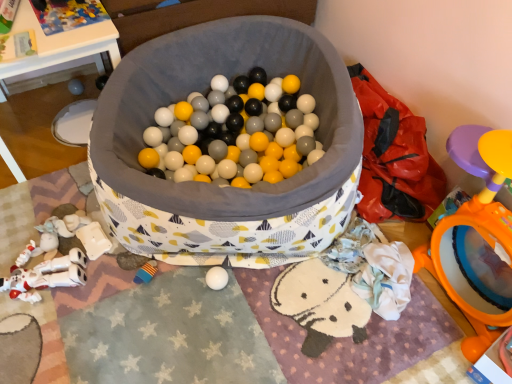
Measure the distance between point (x=472, y=227) and camera.

Point (x=472, y=227) and camera are 1.17 meters apart.

Find the location of `soft plush toy at lower left, positioned as the fourth toy in left-to-right order`. soft plush toy at lower left, positioned as the fourth toy in left-to-right order is located at coordinates (146, 272).

What do you see at coordinates (75, 87) in the screenshot? I see `matte gray ball at left, which is the fifth toy from right to left` at bounding box center [75, 87].

In order to face white plush toy at lower left, which is the 4th toy in top-to-bottom order, should I rotate leftwards or rightwards?

You should rotate left by 26.653 degrees.

This screenshot has width=512, height=384. Identify the location of fabric-lined ball pit at center. (205, 89).

Identify the location of orange plastic mirror at right, acting as the 3th toy starting from the top. The image size is (512, 384). (477, 239).

Can you confirm if white plush toy at lower left, arranged as the 2th toy when viewed from the front, is smaller than matte gray ball at left, the 1th toy from the back?

No, white plush toy at lower left, arranged as the 2th toy when viewed from the front, is not smaller than matte gray ball at left, the 1th toy from the back.

Considering the relative sizes of white plush toy at lower left, which is the 4th toy in top-to-bottom order, and matte gray ball at left, the 1th toy from the back, in the image provided, is white plush toy at lower left, which is the 4th toy in top-to-bottom order, wider than matte gray ball at left, the 1th toy from the back,?

Correct, the width of white plush toy at lower left, which is the 4th toy in top-to-bottom order, exceeds that of matte gray ball at left, the 1th toy from the back.

In terms of height, does white plush toy at lower left, the second toy positioned from the bottom, look taller or shorter compared to matte gray ball at left, the 1th toy from the back?

Clearly, white plush toy at lower left, the second toy positioned from the bottom, is taller compared to matte gray ball at left, the 1th toy from the back.

Locate an element on the screen. toy that is the 2nd object located above the white plush toy at lower left, the second toy positioned from the bottom (from the image's perspective) is located at coordinates (75, 87).

Does matte gray ball at left, which appears as the first toy when viewed from the left, come behind orange plastic mirror at right, arranged as the fifth toy when viewed from the back?

Yes, matte gray ball at left, which appears as the first toy when viewed from the left, is behind orange plastic mirror at right, arranged as the fifth toy when viewed from the back.

Which is further, (x=76, y=93) or (x=447, y=291)?

The point (x=76, y=93) is farther.

Are matte gray ball at left, arranged as the second toy when viewed from the top, and orange plastic mirror at right, arranged as the fifth toy when viewed from the back, located far from each other?

Yes.

From the image's perspective, does matte gray ball at left, the fourth toy positioned from the bottom, appear higher than orange plastic mirror at right, acting as the 3th toy starting from the top?

Yes, from the image's perspective, matte gray ball at left, the fourth toy positioned from the bottom, is above orange plastic mirror at right, acting as the 3th toy starting from the top.

Who is taller, fabric-lined ball pit at center or plastic colorful puzzle pieces at upper left, positioned as the third toy in right-to-left order?

Standing taller between the two is fabric-lined ball pit at center.

From a real-world perspective, is fabric-lined ball pit at center positioned above or below plastic colorful puzzle pieces at upper left, placed as the 3th toy when sorted from left to right?

Clearly, from a real-world perspective, fabric-lined ball pit at center is below plastic colorful puzzle pieces at upper left, placed as the 3th toy when sorted from left to right.

Is fabric-lined ball pit at center oriented away from plastic colorful puzzle pieces at upper left, marked as the fifth toy in a bottom-to-top arrangement?

No, fabric-lined ball pit at center is not facing away from plastic colorful puzzle pieces at upper left, marked as the fifth toy in a bottom-to-top arrangement.

From a real-world perspective, starting from the fabric-lined ball pit at center, which toy is the 2nd one vertically above it? Please provide its 2D coordinates.

[(67, 14)]

Is orange plastic mirror at right, arranged as the 3th toy when ordered from the bottom, in contact with soft plush toy at lower left, positioned as the 2th toy in right-to-left order?

orange plastic mirror at right, arranged as the 3th toy when ordered from the bottom, and soft plush toy at lower left, positioned as the 2th toy in right-to-left order, are not in contact.

From the image's perspective, is orange plastic mirror at right, acting as the first toy starting from the front, on soft plush toy at lower left, positioned as the 2th toy in right-to-left order?

Yes.

From a real-world perspective, who is located lower, orange plastic mirror at right, acting as the first toy starting from the front, or soft plush toy at lower left, positioned as the fourth toy in left-to-right order?

soft plush toy at lower left, positioned as the fourth toy in left-to-right order, is physically lower.

Considering the sizes of objects orange plastic mirror at right, which is counted as the fifth toy, starting from the left, and soft plush toy at lower left, the third toy in the front-to-back sequence, in the image provided, who is wider, orange plastic mirror at right, which is counted as the fifth toy, starting from the left, or soft plush toy at lower left, the third toy in the front-to-back sequence,?

orange plastic mirror at right, which is counted as the fifth toy, starting from the left.

Is white plush toy at lower left, the second toy positioned from the bottom, not within plastic colorful puzzle pieces at upper left, placed as the 3th toy when sorted from left to right?

Indeed, white plush toy at lower left, the second toy positioned from the bottom, is completely outside plastic colorful puzzle pieces at upper left, placed as the 3th toy when sorted from left to right.

Considering the positions of objects white plush toy at lower left, which ranks as the fourth toy in back-to-front order, and plastic colorful puzzle pieces at upper left, placed as the 3th toy when sorted from left to right, in the image provided, who is behind, white plush toy at lower left, which ranks as the fourth toy in back-to-front order, or plastic colorful puzzle pieces at upper left, placed as the 3th toy when sorted from left to right,?

plastic colorful puzzle pieces at upper left, placed as the 3th toy when sorted from left to right, is more distant.

Looking at this image, considering the relative positions of white plush toy at lower left, which is the 4th toy in top-to-bottom order, and plastic colorful puzzle pieces at upper left, which is counted as the fourth toy, starting from the front, in the image provided, is white plush toy at lower left, which is the 4th toy in top-to-bottom order, to the left of plastic colorful puzzle pieces at upper left, which is counted as the fourth toy, starting from the front, from the viewer's perspective?

Yes, white plush toy at lower left, which is the 4th toy in top-to-bottom order, is to the left of plastic colorful puzzle pieces at upper left, which is counted as the fourth toy, starting from the front.

Is white plush toy at lower left, arranged as the 2th toy when viewed from the front, directly adjacent to plastic colorful puzzle pieces at upper left, marked as the fifth toy in a bottom-to-top arrangement?

No, white plush toy at lower left, arranged as the 2th toy when viewed from the front, is not in contact with plastic colorful puzzle pieces at upper left, marked as the fifth toy in a bottom-to-top arrangement.

Is the surface of soft plush toy at lower left, positioned as the 5th toy in top-to-bottom order, in direct contact with white plush toy at lower left, arranged as the 2th toy when viewed from the front?

No.

Is white plush toy at lower left, which is counted as the 2th toy, starting from the left, at the back of soft plush toy at lower left, which appears as the first toy when ordered from the bottom?

No, soft plush toy at lower left, which appears as the first toy when ordered from the bottom,'s orientation is not away from white plush toy at lower left, which is counted as the 2th toy, starting from the left.

Image resolution: width=512 pixels, height=384 pixels. I want to click on laundry basket located above the white plush toy at lower left, the second toy positioned from the bottom (from the image's perspective), so click(205, 89).

Which of these two, white plush toy at lower left, arranged as the 2th toy when viewed from the front, or fabric-lined ball pit at center, is smaller?

white plush toy at lower left, arranged as the 2th toy when viewed from the front.

From the image's perspective, would you say white plush toy at lower left, the second toy positioned from the bottom, is positioned over fabric-lined ball pit at center?

Actually, white plush toy at lower left, the second toy positioned from the bottom, appears below fabric-lined ball pit at center in the image.

From the image's perspective, count 2nd toys upward from the white plush toy at lower left, which is counted as the 2th toy, starting from the left, and point to it. Please provide its 2D coordinates.

[(75, 87)]

Where is `toy that is the 2nd object directly below the orange plastic mirror at right, arranged as the fifth toy when viewed from the back (from a real-world perspective)`? toy that is the 2nd object directly below the orange plastic mirror at right, arranged as the fifth toy when viewed from the back (from a real-world perspective) is located at coordinates (75, 87).

From the picture: Looking at the image, which one is located closer to fabric-lined ball pit at center, soft plush toy at lower left, positioned as the fourth toy in left-to-right order, or plastic colorful puzzle pieces at upper left, placed as the 3th toy when sorted from left to right?

Among the two, plastic colorful puzzle pieces at upper left, placed as the 3th toy when sorted from left to right, is located nearer to fabric-lined ball pit at center.

When comparing their distances from soft plush toy at lower left, the third toy viewed from the back, does matte gray ball at left, the 1th toy from the back, or orange plastic mirror at right, arranged as the 3th toy when ordered from the bottom, seem closer?

Based on the image, orange plastic mirror at right, arranged as the 3th toy when ordered from the bottom, appears to be nearer to soft plush toy at lower left, the third toy viewed from the back.

Looking at the image, which one is located closer to matte gray ball at left, which appears as the first toy when viewed from the left, plastic colorful puzzle pieces at upper left, placed as the 3th toy when sorted from left to right, or fabric-lined ball pit at center?

plastic colorful puzzle pieces at upper left, placed as the 3th toy when sorted from left to right.

Consider the image. Which object lies nearer to the anchor point plastic colorful puzzle pieces at upper left, positioned as the third toy in right-to-left order, soft plush toy at lower left, which appears as the first toy when ordered from the bottom, or orange plastic mirror at right, the first toy from the right?

soft plush toy at lower left, which appears as the first toy when ordered from the bottom, lies closer to plastic colorful puzzle pieces at upper left, positioned as the third toy in right-to-left order, than the other object.

Based on their spatial positions, is fabric-lined ball pit at center or plastic colorful puzzle pieces at upper left, the first toy in the top-to-bottom sequence, closer to white plush toy at lower left, which ranks as the fourth toy in back-to-front order?

fabric-lined ball pit at center is closer to white plush toy at lower left, which ranks as the fourth toy in back-to-front order.

When comparing their distances from matte gray ball at left, which appears as the fifth toy when viewed from the front, does orange plastic mirror at right, acting as the first toy starting from the front, or plastic colorful puzzle pieces at upper left, positioned as the third toy in right-to-left order, seem closer?

plastic colorful puzzle pieces at upper left, positioned as the third toy in right-to-left order, is positioned closer to the anchor matte gray ball at left, which appears as the fifth toy when viewed from the front.

From the picture: From the image, which object appears to be nearer to plastic colorful puzzle pieces at upper left, placed as the 3th toy when sorted from left to right, white plush toy at lower left, which is counted as the 2th toy, starting from the left, or matte gray ball at left, the 1th toy from the back?

The object closer to plastic colorful puzzle pieces at upper left, placed as the 3th toy when sorted from left to right, is matte gray ball at left, the 1th toy from the back.

Which object lies nearer to the anchor point orange plastic mirror at right, which is counted as the fifth toy, starting from the left, fabric-lined ball pit at center or matte gray ball at left, the fourth toy positioned from the bottom?

Among the two, fabric-lined ball pit at center is located nearer to orange plastic mirror at right, which is counted as the fifth toy, starting from the left.

The image size is (512, 384). Find the location of `toy located between plastic colorful puzzle pieces at upper left, placed as the 3th toy when sorted from left to right, and orange plastic mirror at right, acting as the 3th toy starting from the top, in the left-right direction`. toy located between plastic colorful puzzle pieces at upper left, placed as the 3th toy when sorted from left to right, and orange plastic mirror at right, acting as the 3th toy starting from the top, in the left-right direction is located at coordinates (146, 272).

This screenshot has height=384, width=512. I want to click on laundry basket located between plastic colorful puzzle pieces at upper left, placed as the 3th toy when sorted from left to right, and orange plastic mirror at right, arranged as the 3th toy when ordered from the bottom, in the left-right direction, so click(x=205, y=89).

Where is `laundry basket between matte gray ball at left, which appears as the first toy when viewed from the left, and orange plastic mirror at right, arranged as the 3th toy when ordered from the bottom`? laundry basket between matte gray ball at left, which appears as the first toy when viewed from the left, and orange plastic mirror at right, arranged as the 3th toy when ordered from the bottom is located at coordinates (205, 89).

In order to click on laundry basket located between soft plush toy at lower left, positioned as the 2th toy in right-to-left order, and orange plastic mirror at right, acting as the 3th toy starting from the top, in the left-right direction in this screenshot , I will do `click(205, 89)`.